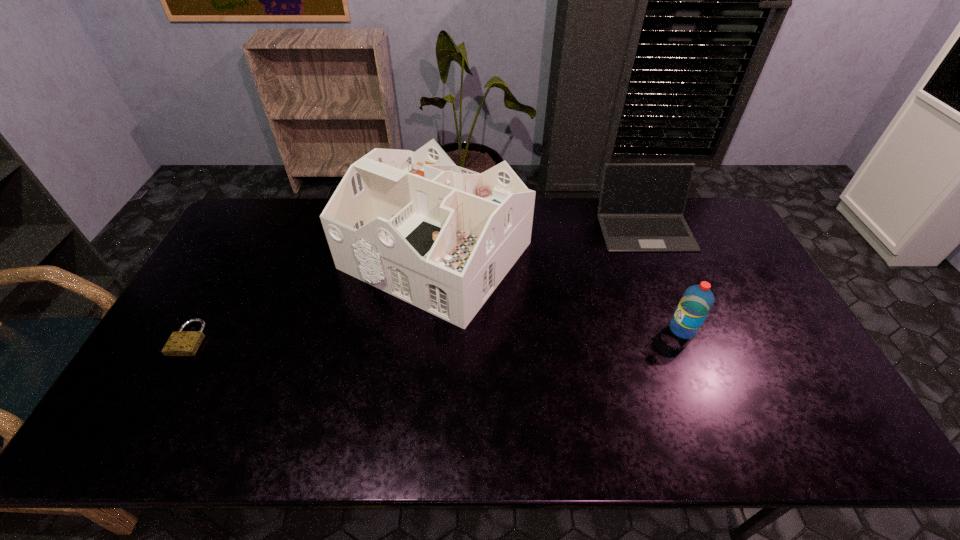
Locate an element on the screen. The image size is (960, 540). free spot between the water bottle and the leftmost object is located at coordinates (436, 334).

I want to click on vacant area that lies between the second object from left to right and the water bottle, so click(559, 293).

Identify which object is the closest to the water bottle. Please provide its 2D coordinates. Your answer should be formatted as a tuple, i.e. [(x, y)], where the tuple contains the x and y coordinates of a point satisfying the conditions above.

[(641, 206)]

At what (x,y) coordinates should I click in order to perform the action: click on object that stands as the third closest to the tallest object. Please return your answer as a coordinate pair (x, y). Image resolution: width=960 pixels, height=540 pixels. Looking at the image, I should click on (696, 302).

The width and height of the screenshot is (960, 540). Find the location of `vacant region that satisfies the following two spatial constraints: 1. on the screen of the laptop; 2. on the front label of the water bottle`. vacant region that satisfies the following two spatial constraints: 1. on the screen of the laptop; 2. on the front label of the water bottle is located at coordinates (685, 329).

Identify the location of vacant space that satisfies the following two spatial constraints: 1. on the screen of the laptop; 2. on the front label of the water bottle. (x=685, y=329).

Find the location of a particular element. Image resolution: width=960 pixels, height=540 pixels. free space that satisfies the following two spatial constraints: 1. on the front label of the water bottle; 2. on the keyhole side of the shortest object is located at coordinates (686, 338).

This screenshot has width=960, height=540. Find the location of `free spot that satisfies the following two spatial constraints: 1. on the front label of the water bottle; 2. on the keyhole side of the padlock`. free spot that satisfies the following two spatial constraints: 1. on the front label of the water bottle; 2. on the keyhole side of the padlock is located at coordinates (686, 338).